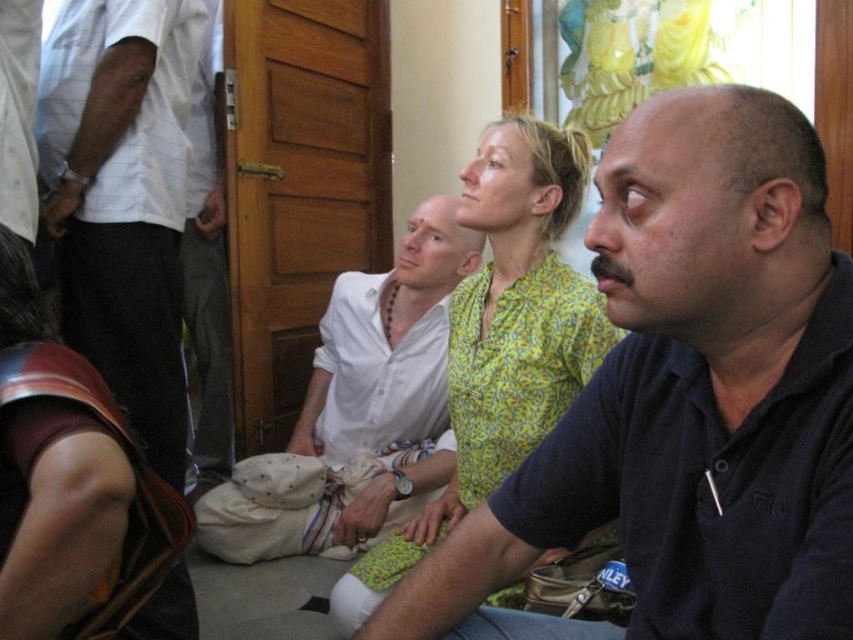
Between white checkered shirt at upper left and leather at lower left, which one is positioned higher?

white checkered shirt at upper left is higher up.

Who is more forward, (186, 163) or (54, 554)?

Point (54, 554)

Locate an element on the screen. This screenshot has width=853, height=640. white checkered shirt at upper left is located at coordinates (123, 196).

Who is positioned more to the left, dark blue polo shirt at center or white checkered shirt at upper left?

white checkered shirt at upper left is more to the left.

Does dark blue polo shirt at center appear over white checkered shirt at upper left?

No.

Image resolution: width=853 pixels, height=640 pixels. I want to click on dark blue polo shirt at center, so click(688, 400).

Does white cotton shirt at center appear on the right side of leather at lower left?

Indeed, white cotton shirt at center is positioned on the right side of leather at lower left.

Which is below, white cotton shirt at center or leather at lower left?

Positioned lower is leather at lower left.

Who is more distant from viewer, (376, 404) or (20, 556)?

The point (376, 404) is behind.

Where is `white cotton shirt at center`? The image size is (853, 640). white cotton shirt at center is located at coordinates (358, 412).